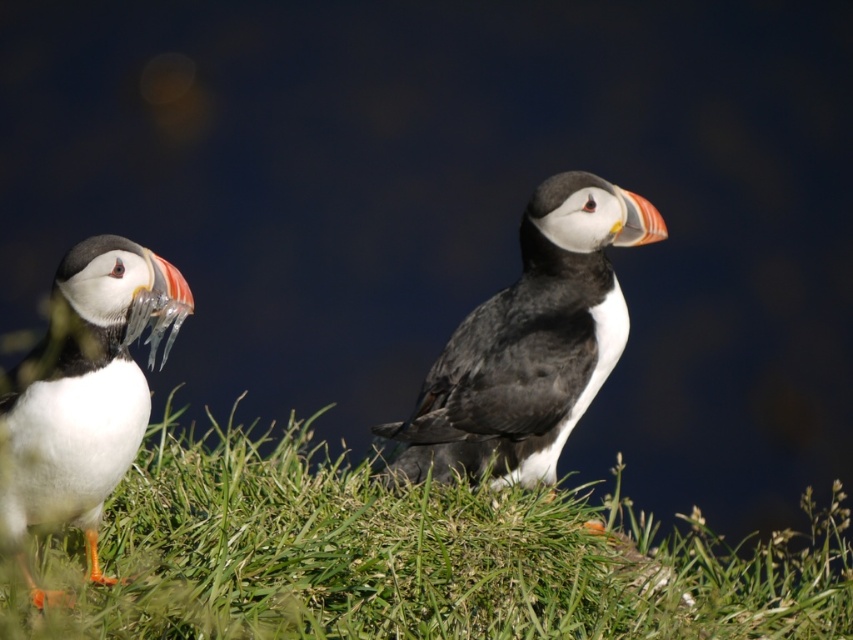
You are a photographer trying to capture a photo of the white matte bird at left and the green grass at center. Which object will occupy more horizontal space in your photo?

The green grass at center will occupy more horizontal space in the photo because its width is larger than the white matte bird at left.

You are a birdwatcher observing the scene from a distance. You notice the green grass at center and the white matte bird at left. Which object is positioned closer to your viewpoint?

The green grass at center is closer to the viewer than the white matte bird at left.

You are a birdwatcher observing the scene. You notice two birds in the image. Which of the two birds, the black matte puffin at center or the white matte bird at left, is closer to you?

The black matte puffin at center is closer to you because it is positioned over the white matte bird at left, indicating it is in front.